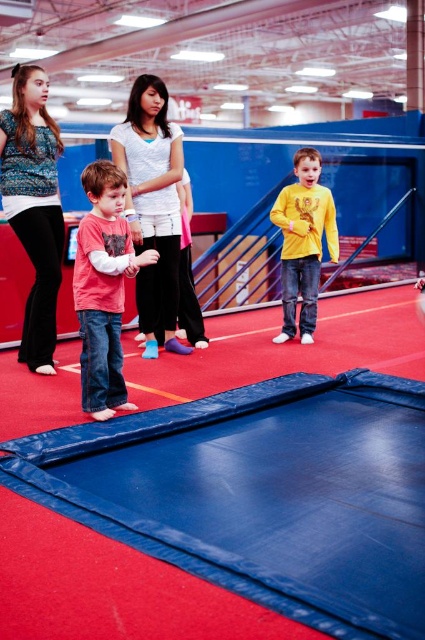
Question: Does blue rubber mat at center appear over patterned fabric blouse at upper left?

Choices:
 (A) no
 (B) yes

Answer: (A)

Question: Is blue rubber mat at center closer to camera compared to patterned fabric blouse at upper left?

Choices:
 (A) no
 (B) yes

Answer: (B)

Question: Among these points, which one is farthest from the camera?

Choices:
 (A) (317, 211)
 (B) (36, 340)
 (C) (390, 429)
 (D) (74, 300)

Answer: (A)

Question: Can you confirm if white cotton shirt at center is positioned below yellow matte shirt at center?

Choices:
 (A) yes
 (B) no

Answer: (B)

Question: Among these points, which one is nearest to the camera?

Choices:
 (A) (282, 340)
 (B) (13, 125)
 (C) (159, 330)
 (D) (78, 273)

Answer: (D)

Question: Which point is closer to the camera?

Choices:
 (A) (8, 220)
 (B) (333, 564)
 (C) (116, 236)

Answer: (B)